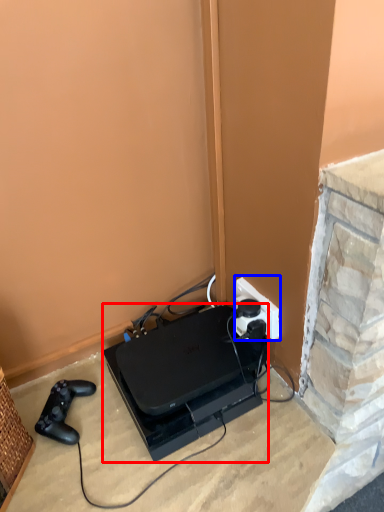
Question: Among these objects, which one is farthest to the camera, appliance (highlighted by a red box) or power plugs and sockets (highlighted by a blue box)?

Choices:
 (A) appliance
 (B) power plugs and sockets

Answer: (B)